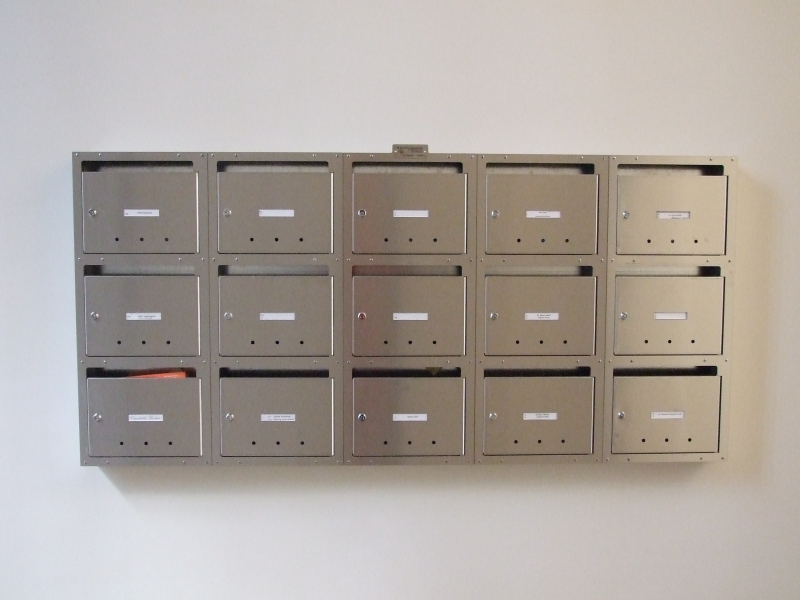
You are a GUI agent. You are given a task and a screenshot of the screen. Output one action in this format:
    pyautogui.click(x=<x>, y=<y>)
    Task: Click on the shadow below mailboxes
    
    Given the screenshot: What is the action you would take?
    pyautogui.click(x=218, y=478)